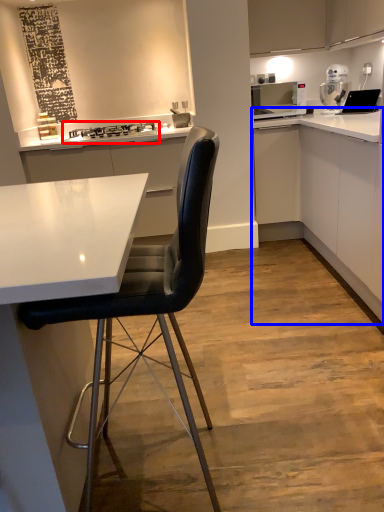
Question: Which object appears farthest to the camera in this image, stove (highlighted by a red box) or cabinetry (highlighted by a blue box)?

Choices:
 (A) stove
 (B) cabinetry

Answer: (A)